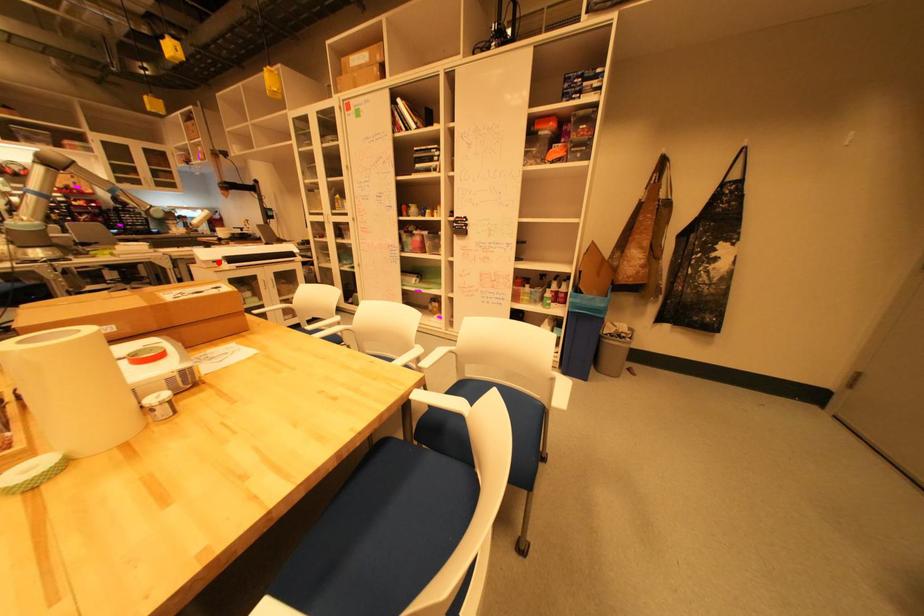
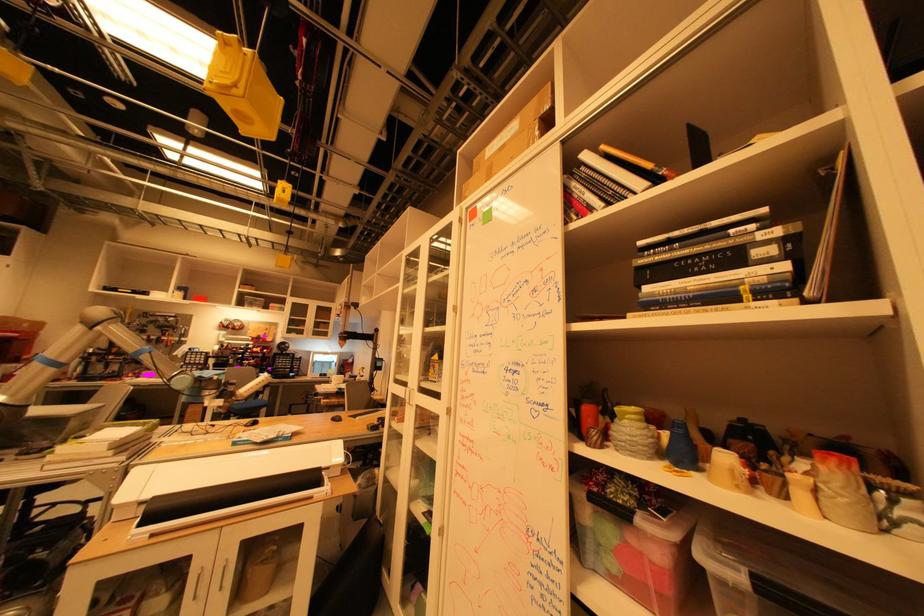
Locate, in the second image, the point that corresponds to the highlighted location in the first image.

(138, 505)